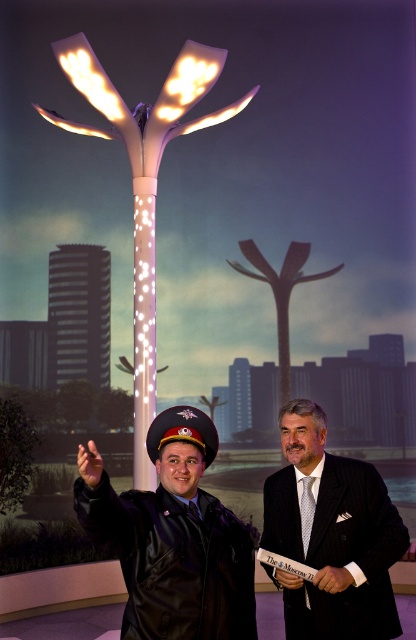
Question: Considering the relative positions of dark suit at center and matte black hand at lower center in the image provided, where is dark suit at center located with respect to matte black hand at lower center?

Choices:
 (A) right
 (B) left

Answer: (A)

Question: Which point is closer to the camera?

Choices:
 (A) (160, 548)
 (B) (317, 586)

Answer: (A)

Question: Which object is farther from the camera taking this photo?

Choices:
 (A) smooth skin hand at lower left
 (B) smooth leather hand at lower center

Answer: (B)

Question: Observing the image, what is the correct spatial positioning of shiny black uniform at center in reference to smooth leather hand at lower center?

Choices:
 (A) above
 (B) below

Answer: (A)

Question: Does shiny black uniform at center appear under black leather jacket at lower left?

Choices:
 (A) yes
 (B) no

Answer: (B)

Question: Which point is closer to the camera taking this photo?

Choices:
 (A) click(341, 586)
 (B) click(207, 436)
 (C) click(383, 637)

Answer: (B)